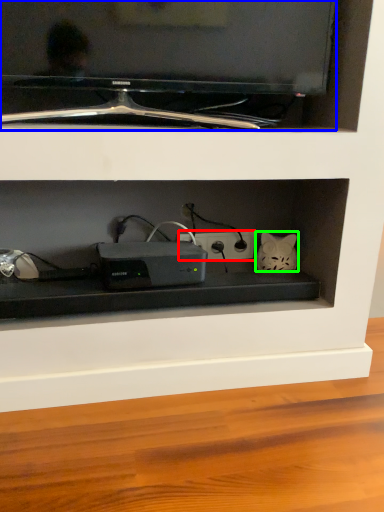
Question: Considering the real-world distances, which object is farthest from electric outlet (highlighted by a red box)? television (highlighted by a blue box) or cat (highlighted by a green box)?

Choices:
 (A) television
 (B) cat

Answer: (A)